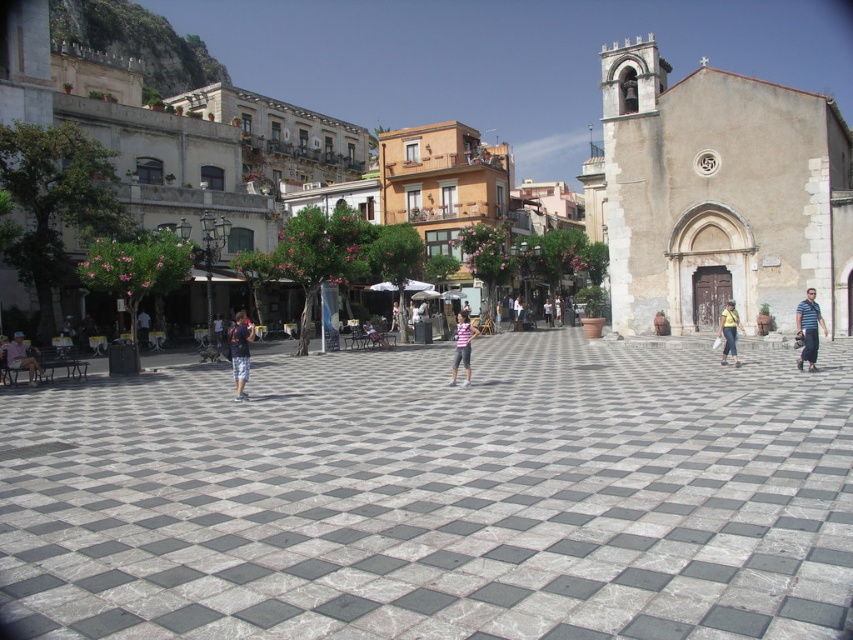
You are a tourist standing in the urban square and want to take a photo of the marble tiles at center and the pink striped shirt at center. Which object should you focus on first if you want to capture both in a single frame without moving the camera?

The marble tiles at center is bigger than the pink striped shirt at center, so you should focus on the marble tiles at center first to ensure both objects are in clear view.

You are standing in the urban square and want to find the striped fabric at center. According to the scene description, where should you look relative to the buildings on the left side?

The striped fabric at center is located at the central area of the square, which is away from the buildings on the left side. Since the buildings on the left are part of the surrounding structures, the striped fabric at center would be positioned towards the middle of the square, opposite the left buildings.